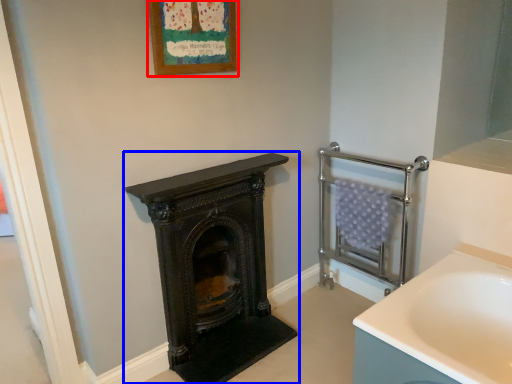
Question: Among these objects, which one is nearest to the camera, picture frame (highlighted by a red box) or wood burning stove (highlighted by a blue box)?

Choices:
 (A) picture frame
 (B) wood burning stove

Answer: (A)